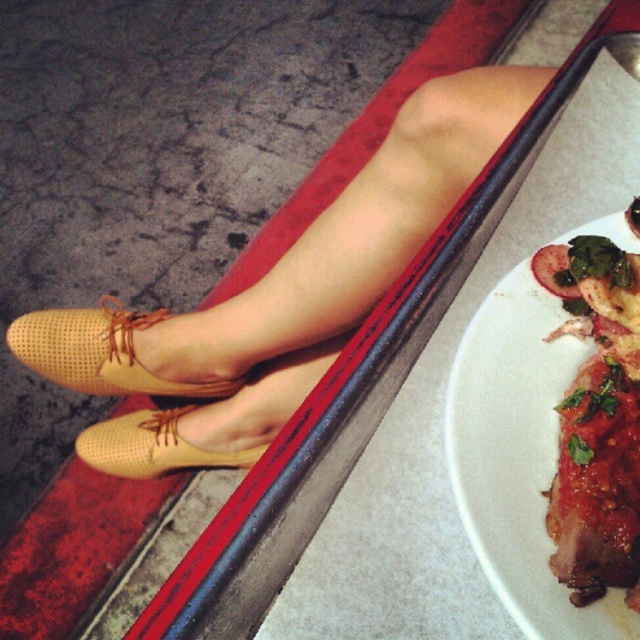
Which of these two, tan perforated shoes at center or tan perforated shoe at lower left, stands shorter?

With less height is tan perforated shoe at lower left.

Between tan perforated shoes at center and tan perforated shoe at lower left, which one appears on the left side from the viewer's perspective?

From the viewer's perspective, tan perforated shoe at lower left appears more on the left side.

I want to click on tan perforated shoes at center, so click(x=280, y=296).

Is the position of tan perforated shoe at center more distant than that of tan perforated shoe at lower left?

No, it is in front of tan perforated shoe at lower left.

Can you confirm if tan perforated shoe at center is positioned to the left of tan perforated shoe at lower left?

In fact, tan perforated shoe at center is to the right of tan perforated shoe at lower left.

Which is behind, point (202, 433) or point (74, 378)?

Positioned behind is point (74, 378).

You are a GUI agent. You are given a task and a screenshot of the screen. Output one action in this format:
    pyautogui.click(x=<x>, y=<y>)
    Task: Click on the tan perforated shoe at center
    This screenshot has height=640, width=640.
    Given the screenshot: What is the action you would take?
    pyautogui.click(x=208, y=422)

Between point (388, 170) and point (536, 288), which one is positioned behind?

Positioned behind is point (388, 170).

Describe the element at coordinates (280, 296) in the screenshot. This screenshot has width=640, height=640. I see `tan perforated shoes at center` at that location.

Identify the location of tan perforated shoes at center. (280, 296).